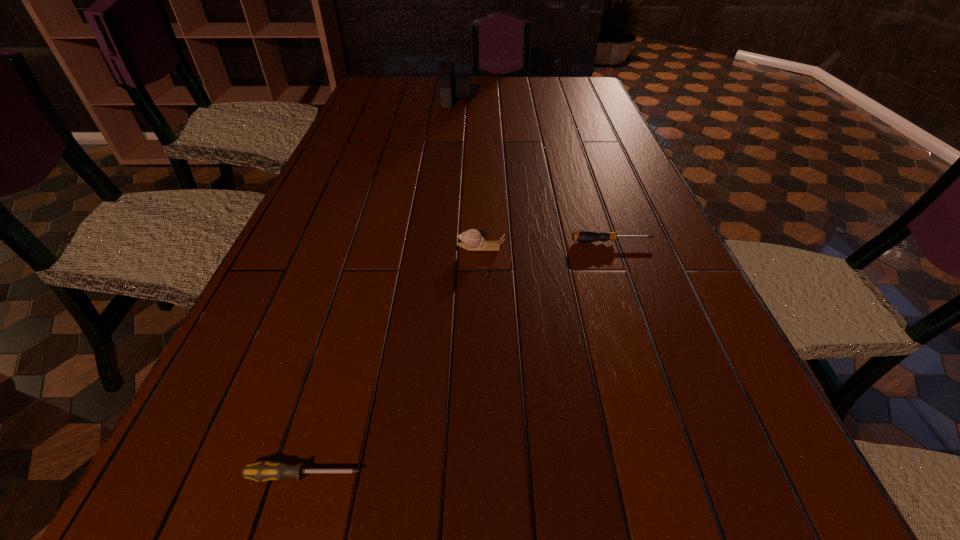
Select which object is the closest to the left screwdriver. Please provide its 2D coordinates. Your answer should be formatted as a tuple, i.e. [(x, y)], where the tuple contains the x and y coordinates of a point satisfying the conditions above.

[(472, 240)]

Select which object is the second closest to the left screwdriver. Please provide its 2D coordinates. Your answer should be formatted as a tuple, i.e. [(x, y)], where the tuple contains the x and y coordinates of a point satisfying the conditions above.

[(584, 236)]

Locate an element on the screen. free space that satisfies the following two spatial constraints: 1. at the lens of the camera; 2. on the left side of the rightmost object is located at coordinates (441, 241).

This screenshot has height=540, width=960. Find the location of `free region that satisfies the following two spatial constraints: 1. at the lens of the right screwdriver; 2. on the right side of the tallest object`. free region that satisfies the following two spatial constraints: 1. at the lens of the right screwdriver; 2. on the right side of the tallest object is located at coordinates (441, 241).